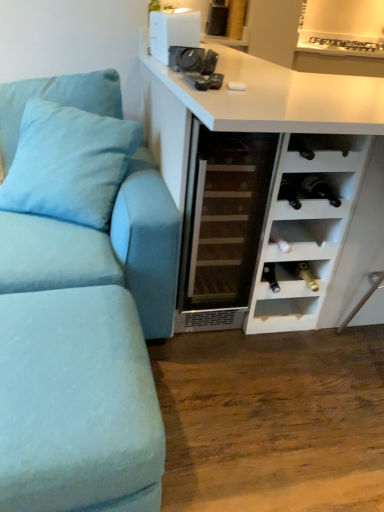
Question: Is light blue fabric couch at left wider or thinner than black glass wine bottles at lower right, the 2th shelf positioned from the top?

Choices:
 (A) thin
 (B) wide

Answer: (B)

Question: From the image's perspective, is light blue fabric couch at left above or below black glass wine bottles at lower right, the 3th shelf when ordered from bottom to top?

Choices:
 (A) above
 (B) below

Answer: (A)

Question: Which object is positioned farthest from the light blue fabric pillow at left?

Choices:
 (A) white matte wine cabinet at center
 (B) transparent glass wine cooler at center
 (C) black glass wine bottles at lower right, the 2th shelf positioned from the top
 (D) light blue fabric couch at left
 (E) white matte wine rack at right, the fourth shelf ordered from the bottom

Answer: (E)

Question: Estimate the real-world distances between objects in this image. Which object is farther from the white matte wine cabinet at center?

Choices:
 (A) light blue fabric couch at left
 (B) white matte wine rack at right, placed as the 1th shelf when sorted from top to bottom
 (C) black glass wine bottles at lower right, the 2th shelf positioned from the top
 (D) matte white shelf at lower right, which appears as the second shelf when ordered from the bottom
 (E) white plastic speaker at upper center

Answer: (E)